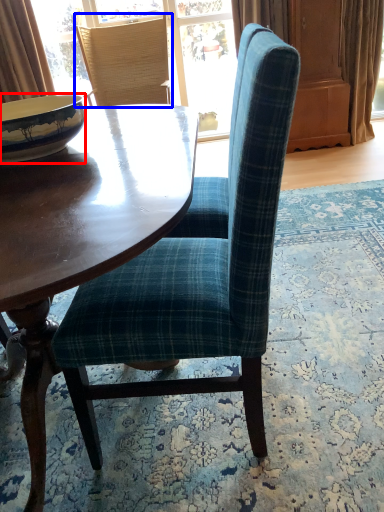
Question: Which point is closer to the camera, bowl (highlighted by a red box) or chair (highlighted by a blue box)?

Choices:
 (A) bowl
 (B) chair

Answer: (A)